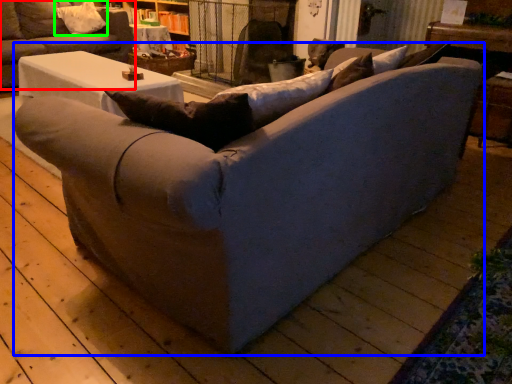
Question: Estimate the real-world distances between objects in this image. Which object is closer to studio couch (highlighted by a red box), studio couch (highlighted by a blue box) or pillow (highlighted by a green box)?

Choices:
 (A) studio couch
 (B) pillow

Answer: (B)